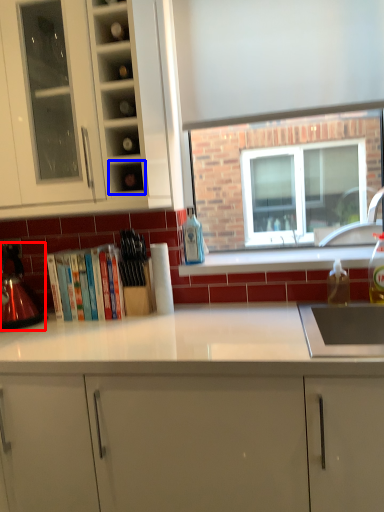
Question: Which point is closer to the camera, kitchen appliance (highlighted by a red box) or shelf (highlighted by a blue box)?

Choices:
 (A) kitchen appliance
 (B) shelf

Answer: (B)